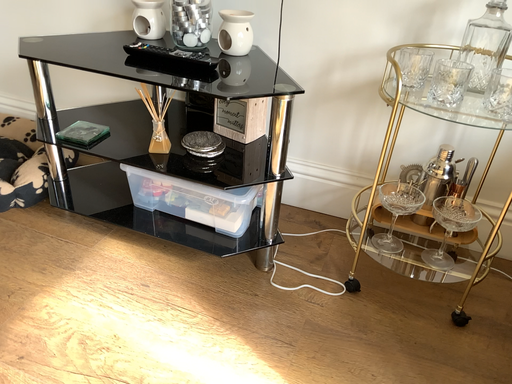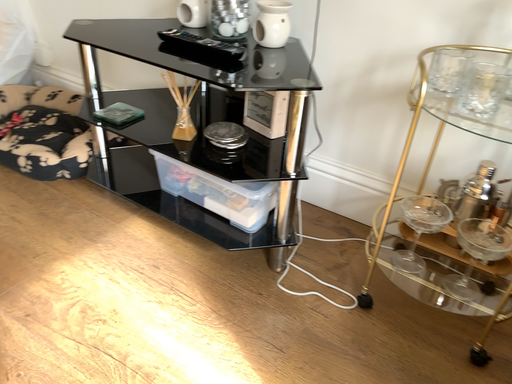
Question: How did the camera likely rotate when shooting the video?

Choices:
 (A) rotated right
 (B) rotated left

Answer: (B)